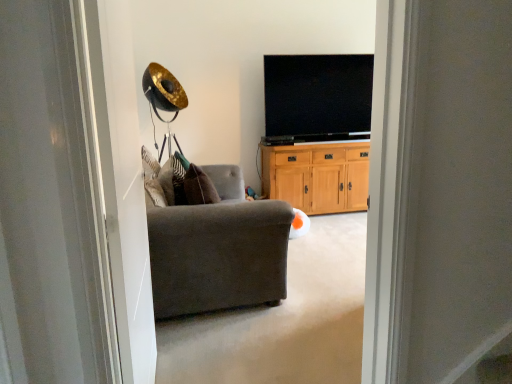
Question: Is flat screen tv at upper center not near wooden cabinet at center?

Choices:
 (A) no
 (B) yes

Answer: (A)

Question: Is flat screen tv at upper center thinner than wooden cabinet at center?

Choices:
 (A) no
 (B) yes

Answer: (B)

Question: Does flat screen tv at upper center have a greater width compared to wooden cabinet at center?

Choices:
 (A) no
 (B) yes

Answer: (A)

Question: Does flat screen tv at upper center have a lesser height compared to wooden cabinet at center?

Choices:
 (A) yes
 (B) no

Answer: (B)

Question: Does flat screen tv at upper center have a smaller size compared to wooden cabinet at center?

Choices:
 (A) no
 (B) yes

Answer: (B)

Question: From the image's perspective, is flat screen tv at upper center on top of wooden cabinet at center?

Choices:
 (A) no
 (B) yes

Answer: (B)

Question: Is dark gray fabric armchair at center smaller than wooden cabinet at center?

Choices:
 (A) yes
 (B) no

Answer: (B)

Question: Is dark gray fabric armchair at center shorter than wooden cabinet at center?

Choices:
 (A) no
 (B) yes

Answer: (B)

Question: From a real-world perspective, is dark gray fabric armchair at center located higher than wooden cabinet at center?

Choices:
 (A) no
 (B) yes

Answer: (A)

Question: Is dark gray fabric armchair at center placed right next to wooden cabinet at center?

Choices:
 (A) yes
 (B) no

Answer: (B)

Question: Considering the relative sizes of dark gray fabric armchair at center and wooden cabinet at center in the image provided, is dark gray fabric armchair at center wider than wooden cabinet at center?

Choices:
 (A) no
 (B) yes

Answer: (B)

Question: Is wooden cabinet at center surrounded by dark gray fabric armchair at center?

Choices:
 (A) yes
 (B) no

Answer: (B)

Question: Does dark gray fabric armchair at center come behind flat screen tv at upper center?

Choices:
 (A) yes
 (B) no

Answer: (B)